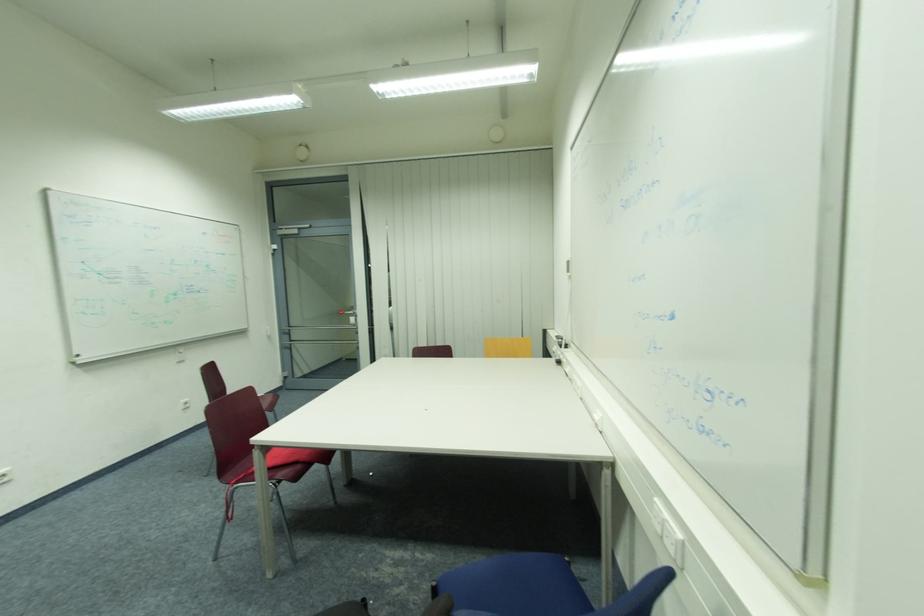
Locate an element on the screen. The height and width of the screenshot is (616, 924). blue chair armrest is located at coordinates tap(440, 606).